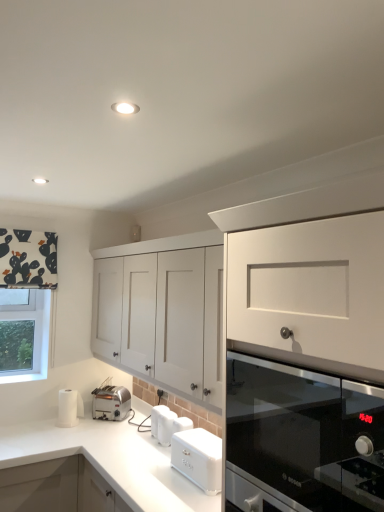
Question: Does point (153, 432) appear closer or farther from the camera than point (187, 316)?

Choices:
 (A) farther
 (B) closer

Answer: (A)

Question: Considering the positions of white plastic toaster at lower center and white matte cabinet at center in the image, is white plastic toaster at lower center taller or shorter than white matte cabinet at center?

Choices:
 (A) tall
 (B) short

Answer: (B)

Question: Which object is positioned farthest from the silver metallic toaster at lower left, which is counted as the second kitchen appliance, starting from the right?

Choices:
 (A) black printed fabric at upper left
 (B) white plastic toaster at lower center
 (C) clear glass window at left
 (D) white matte bread bin at lower center, which is counted as the 1th kitchen appliance, starting from the front
 (E) black glass oven at right

Answer: (E)

Question: Which of these objects is positioned closest to the white matte bread bin at lower center, the second kitchen appliance viewed from the left?

Choices:
 (A) white matte cabinet at center
 (B) silver metallic toaster at lower left, placed as the second kitchen appliance when sorted from front to back
 (C) black glass oven at right
 (D) white plastic toaster at lower center
 (E) black printed fabric at upper left

Answer: (D)